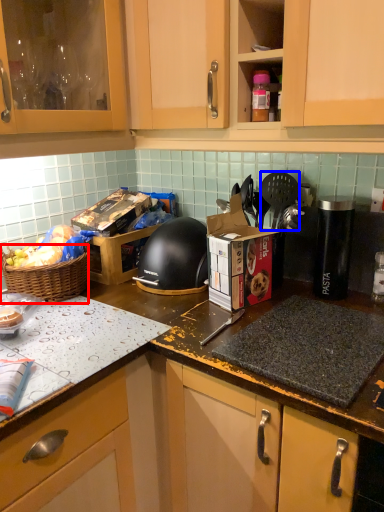
Question: Among these objects, which one is farthest to the camera, picnic basket (highlighted by a red box) or spatula (highlighted by a blue box)?

Choices:
 (A) picnic basket
 (B) spatula

Answer: (B)